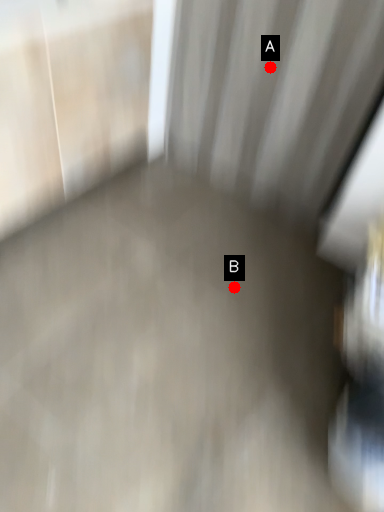
Question: Two points are circled on the image, labeled by A and B beside each circle. Which of the following is the farthest from the observer?

Choices:
 (A) A is further
 (B) B is further

Answer: (B)